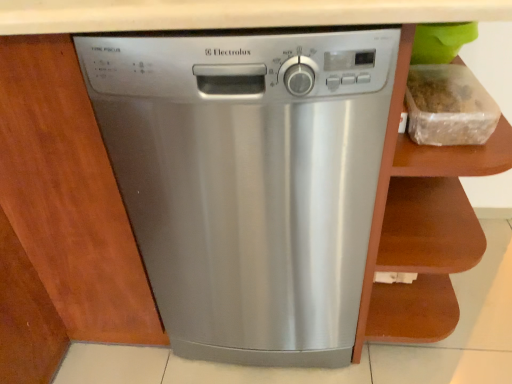
Question: Considering the relative sizes of stainless steel dishwasher at center and clear plastic container at upper right in the image provided, is stainless steel dishwasher at center taller than clear plastic container at upper right?

Choices:
 (A) no
 (B) yes

Answer: (B)

Question: Are stainless steel dishwasher at center and clear plastic container at upper right located far from each other?

Choices:
 (A) yes
 (B) no

Answer: (B)

Question: From a real-world perspective, is stainless steel dishwasher at center on top of clear plastic container at upper right?

Choices:
 (A) no
 (B) yes

Answer: (A)

Question: Can you confirm if stainless steel dishwasher at center is bigger than clear plastic container at upper right?

Choices:
 (A) yes
 (B) no

Answer: (A)

Question: Does stainless steel dishwasher at center have a smaller size compared to clear plastic container at upper right?

Choices:
 (A) no
 (B) yes

Answer: (A)

Question: Are stainless steel dishwasher at center and clear plastic container at upper right making contact?

Choices:
 (A) yes
 (B) no

Answer: (B)

Question: Is the depth of brown wood cabinet at right less than that of clear plastic container at upper right?

Choices:
 (A) yes
 (B) no

Answer: (A)

Question: Considering the relative positions of brown wood cabinet at right and clear plastic container at upper right in the image provided, is brown wood cabinet at right to the right of clear plastic container at upper right from the viewer's perspective?

Choices:
 (A) yes
 (B) no

Answer: (A)

Question: Is brown wood cabinet at right looking in the opposite direction of clear plastic container at upper right?

Choices:
 (A) no
 (B) yes

Answer: (B)

Question: From a real-world perspective, is brown wood cabinet at right located higher than clear plastic container at upper right?

Choices:
 (A) yes
 (B) no

Answer: (B)

Question: Is brown wood cabinet at right bigger than clear plastic container at upper right?

Choices:
 (A) yes
 (B) no

Answer: (A)

Question: Does brown wood cabinet at right have a greater width compared to clear plastic container at upper right?

Choices:
 (A) yes
 (B) no

Answer: (A)

Question: From the image's perspective, is clear plastic container at upper right over stainless steel dishwasher at center?

Choices:
 (A) yes
 (B) no

Answer: (A)